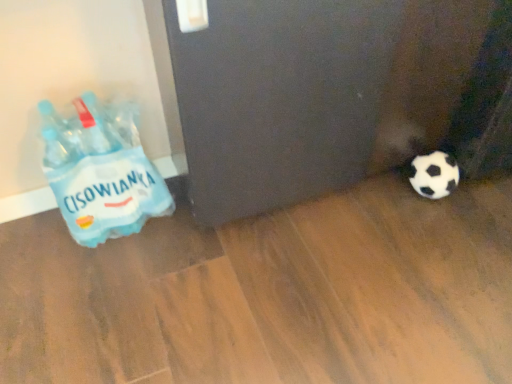
Question: From the image's perspective, is black matte screen door at lower right located above or below blue plastic bottle at left?

Choices:
 (A) below
 (B) above

Answer: (B)

Question: From their relative heights in the image, would you say black matte screen door at lower right is taller or shorter than blue plastic bottle at left?

Choices:
 (A) short
 (B) tall

Answer: (B)

Question: In the image, is black matte screen door at lower right positioned in front of or behind blue plastic bottle at left?

Choices:
 (A) behind
 (B) front

Answer: (B)

Question: From the image's perspective, is blue plastic bottle at left located above or below black matte screen door at lower right?

Choices:
 (A) below
 (B) above

Answer: (A)

Question: Does point (162, 193) appear closer or farther from the camera than point (291, 66)?

Choices:
 (A) farther
 (B) closer

Answer: (A)

Question: Considering their positions, is blue plastic bottle at left located in front of or behind black matte screen door at lower right?

Choices:
 (A) front
 (B) behind

Answer: (B)

Question: Is blue plastic bottle at left inside the boundaries of black matte screen door at lower right, or outside?

Choices:
 (A) inside
 (B) outside

Answer: (B)